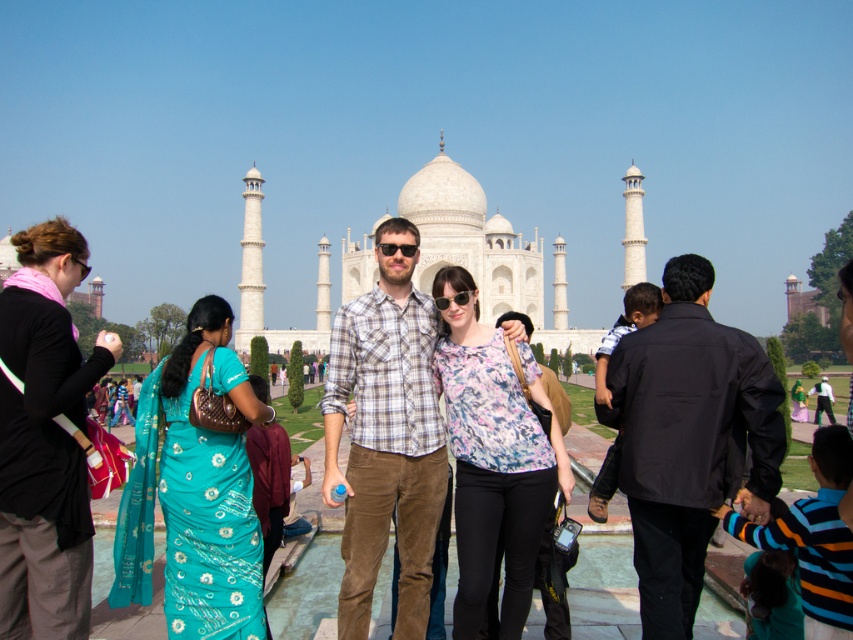
Question: Which object is farther from the camera taking this photo?

Choices:
 (A) black smooth shirt at right
 (B) teal silk saree at left

Answer: (A)

Question: Can you confirm if plaid cotton shirt at center is wider than black fabric jacket at left?

Choices:
 (A) no
 (B) yes

Answer: (B)

Question: Is black fabric jacket at left above teal silk saree at left?

Choices:
 (A) yes
 (B) no

Answer: (A)

Question: Does black smooth shirt at right appear under floral fabric blouse at center?

Choices:
 (A) no
 (B) yes

Answer: (A)

Question: Among these objects, which one is nearest to the camera?

Choices:
 (A) black fabric jacket at left
 (B) black smooth shirt at right
 (C) plaid cotton shirt at center

Answer: (A)

Question: Which of the following is the farthest from the observer?

Choices:
 (A) (370, 422)
 (B) (178, 490)
 (C) (693, 458)

Answer: (A)